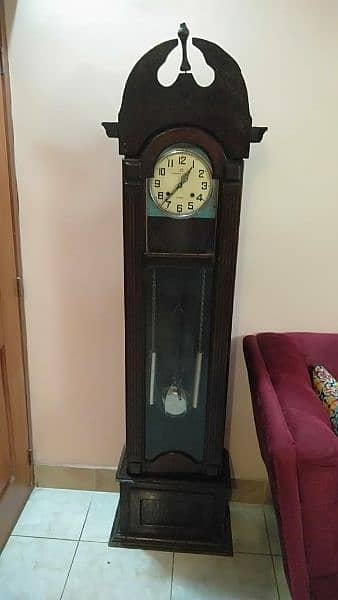
Identify the location of red sofa. The image size is (338, 600). (280, 391).